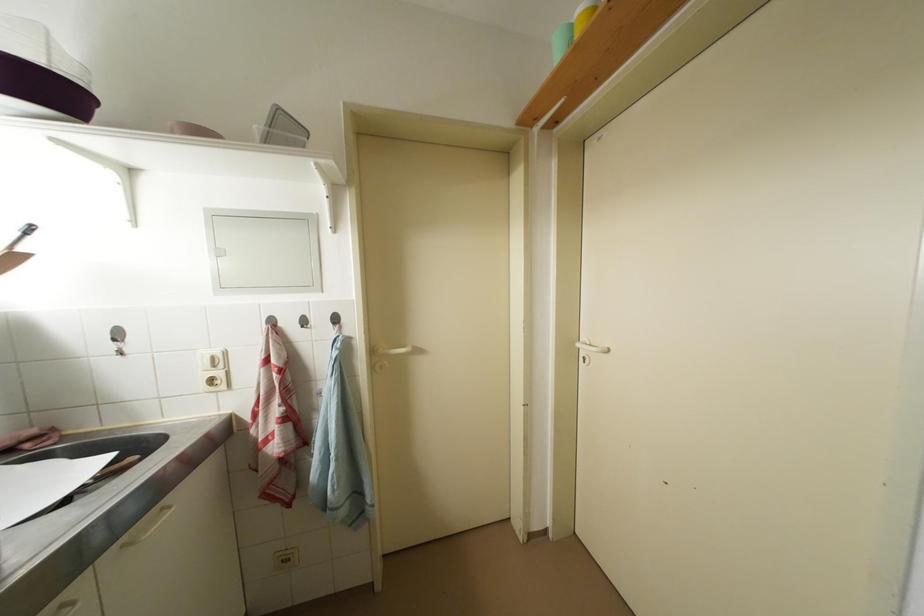
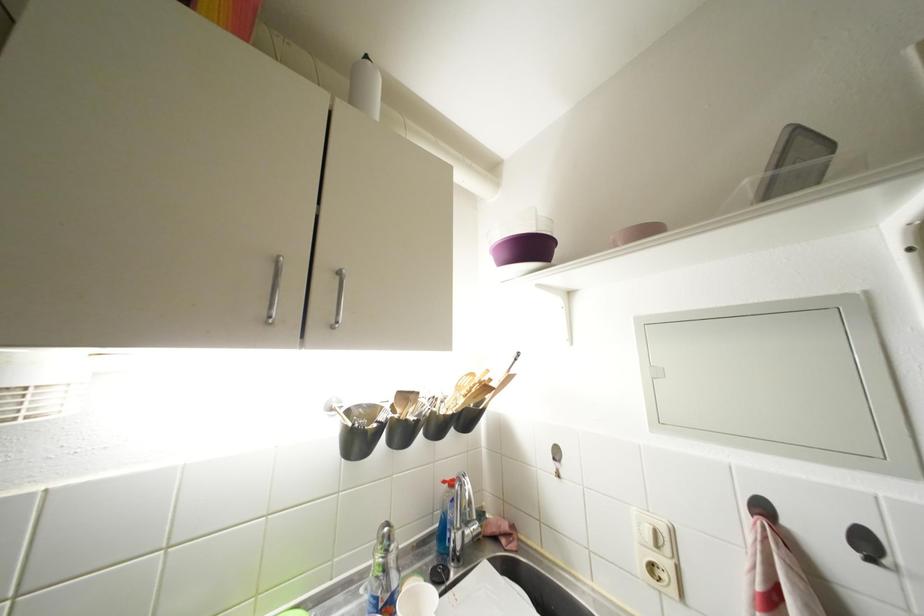
Where in the second image is the point corresponding to (118,350) from the first image?

(560, 469)